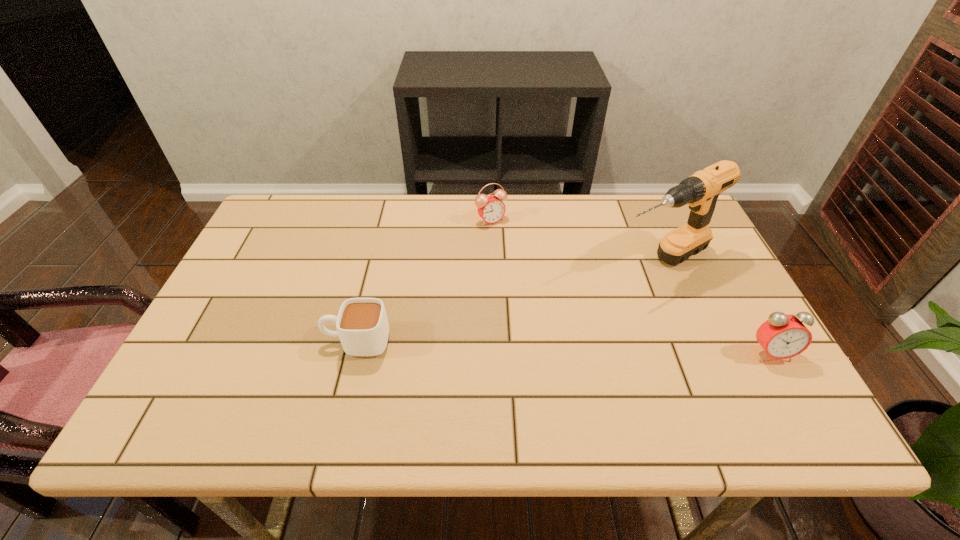
I want to click on object that is the third closest to the left alarm clock, so click(782, 336).

Image resolution: width=960 pixels, height=540 pixels. I want to click on object that is the closest one to the right alarm clock, so (x=700, y=192).